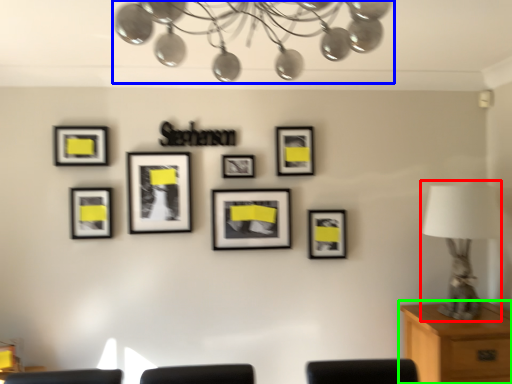
Question: Which object is positioned farthest from table lamp (highlighted by a red box)? Select from lamp (highlighted by a blue box) and table (highlighted by a green box).

Choices:
 (A) lamp
 (B) table

Answer: (A)